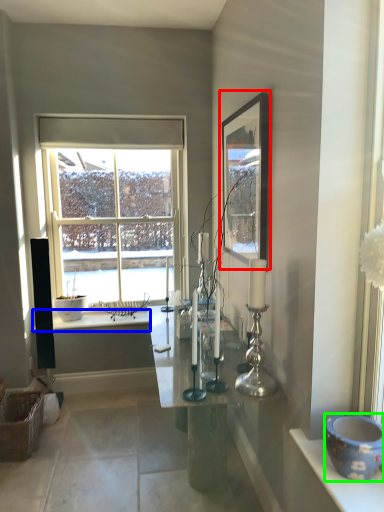
Question: Estimate the real-world distances between objects in this image. Which object is closer to picture frame (highlighted by a red box), counter top (highlighted by a blue box) or pottery (highlighted by a green box)?

Choices:
 (A) counter top
 (B) pottery

Answer: (B)